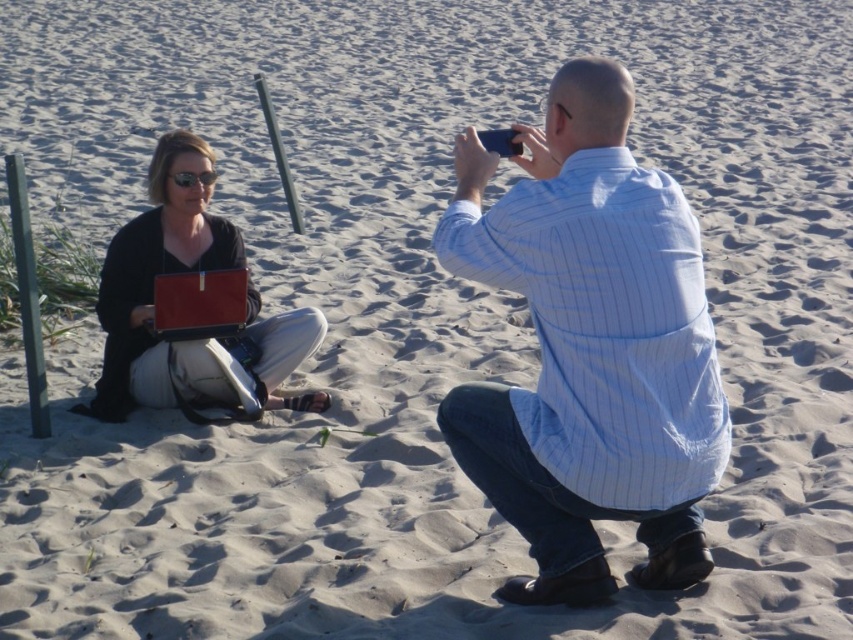
You are standing at the point with coordinates point (x=210, y=381) and want to walk towards the point with coordinates point (x=637, y=428). Which direction should you face to move directly towards your destination?

You should face north because point (x=637, y=428) is in front of point (x=210, y=381).

You are planning to take a photo of the two people on the beach. The white striped shirt at center and the matte black laptop at left are in your viewfinder. According to their positions, which object is closer to the right edge of the photo?

The white striped shirt at center is positioned on the right side of the matte black laptop at left, so it is closer to the right edge of the photo.